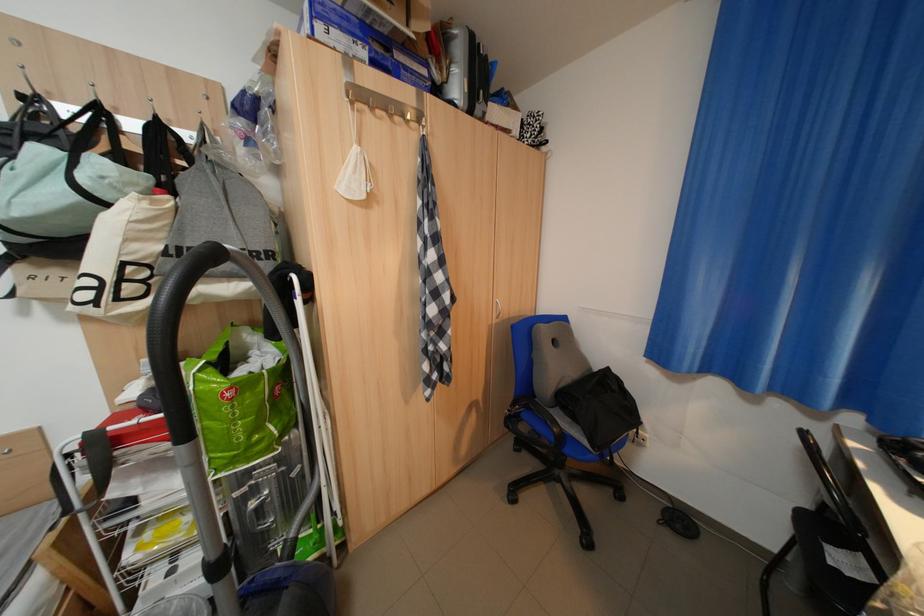
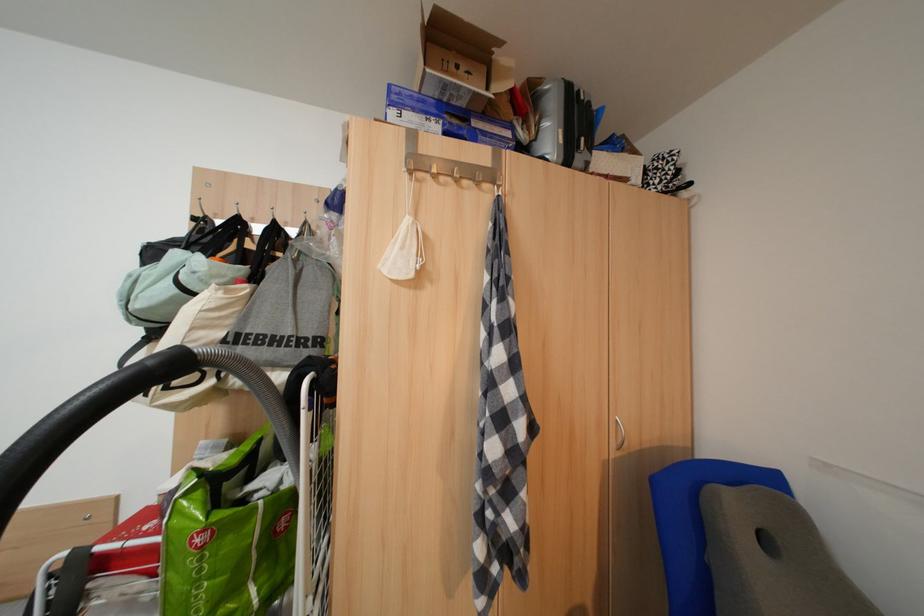
In the second image, find the point that corresponds to point 408,120 in the first image.

(477, 184)